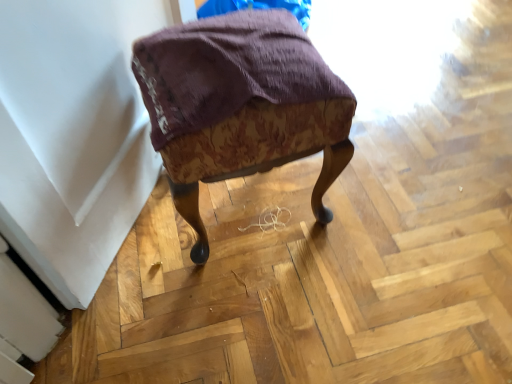
Find the location of a particular element. free space below patterned fabric stool at center (from a real-world perspective) is located at coordinates (250, 205).